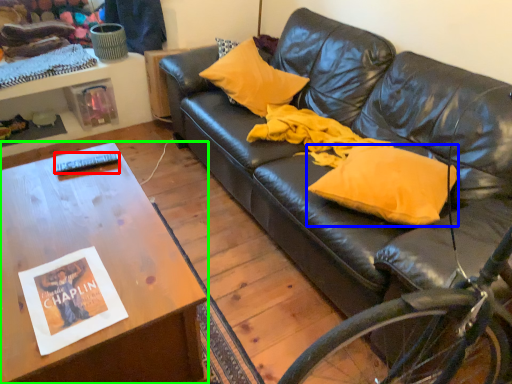
Question: Estimate the real-world distances between objects in this image. Which object is closer to remote control (highlighted by a red box), pillow (highlighted by a blue box) or table (highlighted by a green box)?

Choices:
 (A) pillow
 (B) table

Answer: (B)